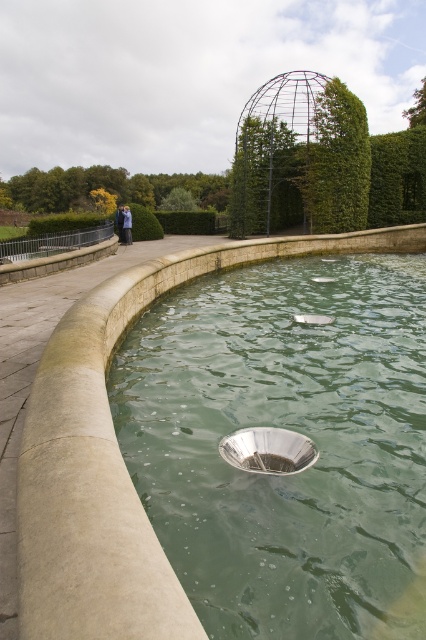
You are standing at the edge of the water feature and want to walk towards the metal framework structure in the background. There are two points marked on the ground, point A at coordinates point A is point (411,198) and point B at point B is point (124,240). Which point should you step on first to reach the metal framework structure more directly?

You should step on point B at point (124,240) first because point A at point (411,198) is behind it, meaning point B is closer to your starting position at the edge of the water feature.

You are standing in the outdoor scene and want to toss a pebble into the metallic silver pool at center. If your arm can reach 2.5 meters, will you be able to reach the pool without moving closer?

The metallic silver pool at center is 2.85 meters away from the viewer. Since your arm can only reach 2.5 meters, you will need to move closer to reach it.

You are standing at the center of the scene and want to walk towards the point marked as point (x=284, y=428). What object will you encounter first?

The metallic silver pool at center is located at point (x=284, y=428), so you will encounter the metallic silver pool at center first.